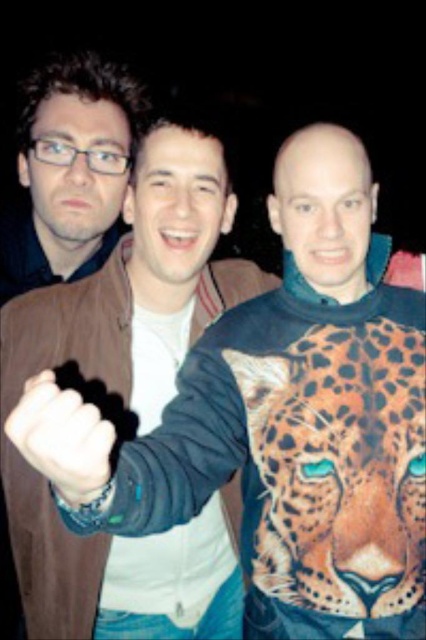
Is orange printed leopard at center positioned before black leather glove at center?

That is False.

Between point (327, 472) and point (55, 449), which one is positioned behind?

Positioned behind is point (327, 472).

Where is `orange printed leopard at center`? The image size is (426, 640). orange printed leopard at center is located at coordinates (333, 458).